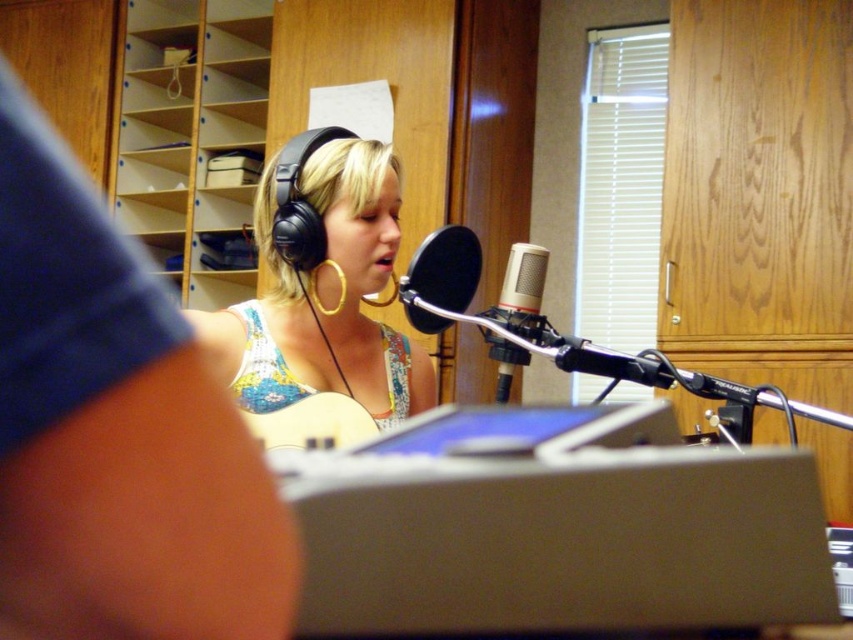
Between black matte headphones at upper left and black matte microphone at center, which one has more height?

With more height is black matte headphones at upper left.

Is point (254, 506) closer to viewer compared to point (426, 280)?

Yes, point (254, 506) is in front of point (426, 280).

The height and width of the screenshot is (640, 853). In order to click on black matte headphones at upper left in this screenshot , I will do `click(115, 433)`.

Is floral fabric bikini top at center thinner than silver metallic microphone at center?

No.

Who is positioned more to the right, floral fabric bikini top at center or silver metallic microphone at center?

silver metallic microphone at center

Is point (253, 332) farther from viewer compared to point (500, 300)?

Yes, it is behind point (500, 300).

Find the location of `floral fabric bikini top at center`. floral fabric bikini top at center is located at coordinates (263, 365).

Can you confirm if black matte headphones at upper left is bigger than light wood bookshelf at upper left?

No, black matte headphones at upper left is not bigger than light wood bookshelf at upper left.

Which is behind, point (9, 83) or point (231, 3)?

The point (231, 3) is behind.

Measure the distance between black matte headphones at upper left and camera.

24.07 centimeters

Locate an element on the screen. black matte headphones at upper left is located at coordinates (115, 433).